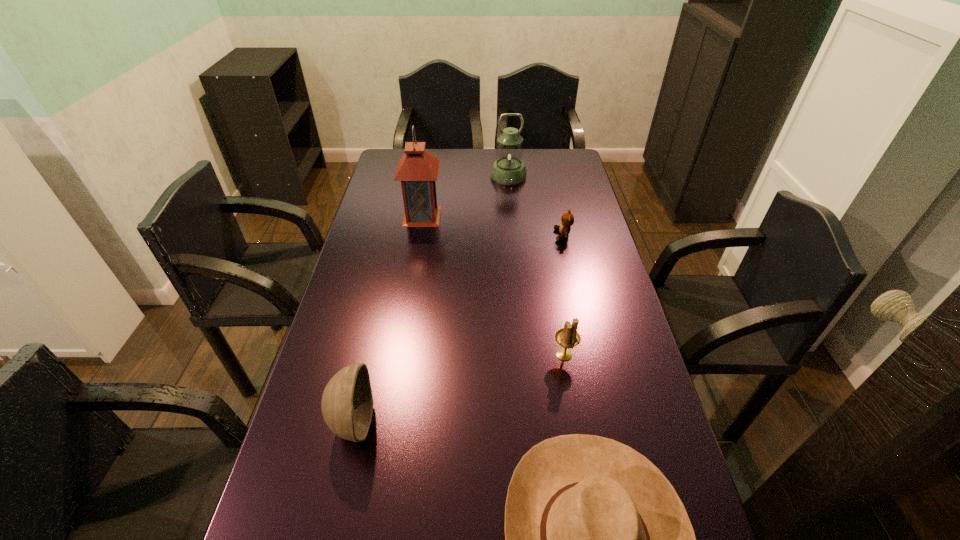
Identify the location of vacant space that's between the bowl and the farthest object. This screenshot has width=960, height=540. (431, 299).

Locate an element on the screen. The height and width of the screenshot is (540, 960). object that is the third closest to the fifth shortest object is located at coordinates (568, 337).

In order to click on object that is the third nearest to the left lantern in this screenshot , I will do `click(568, 337)`.

Where is `free space that satisfies the following two spatial constraints: 1. on the back side of the bowl; 2. on the right side of the right lantern`? free space that satisfies the following two spatial constraints: 1. on the back side of the bowl; 2. on the right side of the right lantern is located at coordinates (409, 176).